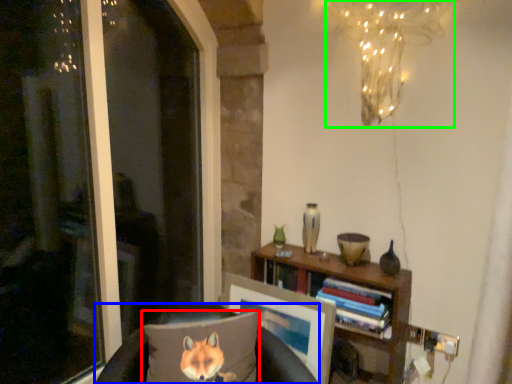
Question: Considering the real-world distances, which object is closest to pillow (highlighted by a red box)? furniture (highlighted by a blue box) or lamp (highlighted by a green box).

Choices:
 (A) furniture
 (B) lamp

Answer: (A)